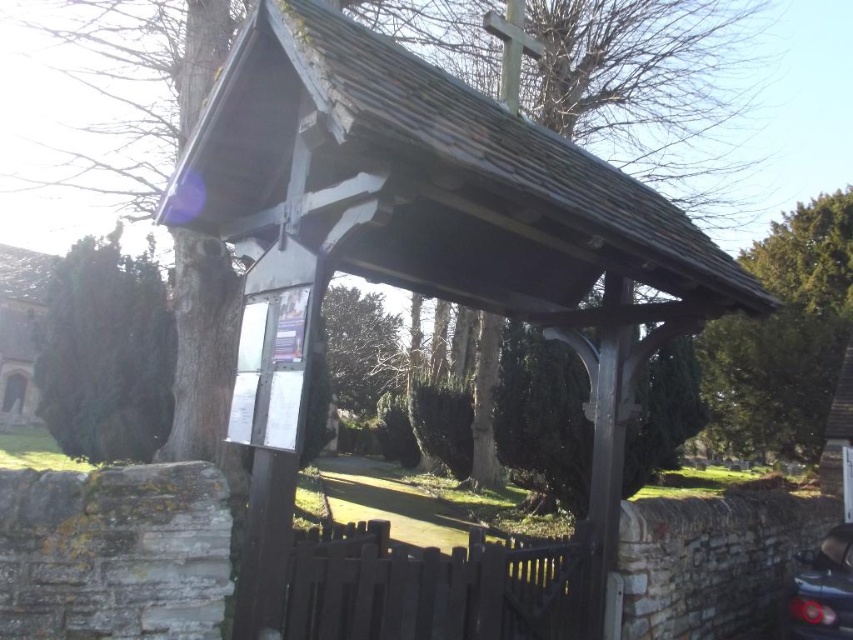
Question: Which of the following is the closest to the observer?

Choices:
 (A) (105, 396)
 (B) (364, 387)

Answer: (A)

Question: From the image, what is the correct spatial relationship of brown wooden gate at center in relation to shiny black car at lower right?

Choices:
 (A) above
 (B) below

Answer: (A)

Question: Which of the following is the farthest from the observer?

Choices:
 (A) green textured hedge at left
 (B) green leafy tree at center
 (C) shiny black car at lower right
 (D) brown wooden gate at center

Answer: (B)

Question: Observing the image, what is the correct spatial positioning of green leafy tree at upper right in reference to green textured hedge at left?

Choices:
 (A) right
 (B) left

Answer: (A)

Question: Which of the following is the farthest from the observer?

Choices:
 (A) (839, 586)
 (B) (363, 305)

Answer: (B)

Question: Does green leafy tree at upper right have a larger size compared to green textured hedge at left?

Choices:
 (A) yes
 (B) no

Answer: (B)